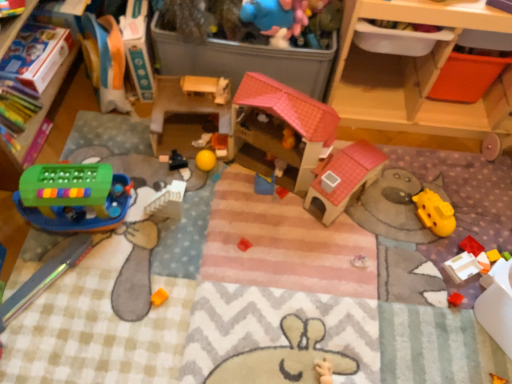
The height and width of the screenshot is (384, 512). What are the coordinates of `free location to the left of wooden dollhouse at center, which is counted as the seventh toy, starting from the right` in the screenshot? It's located at (124, 143).